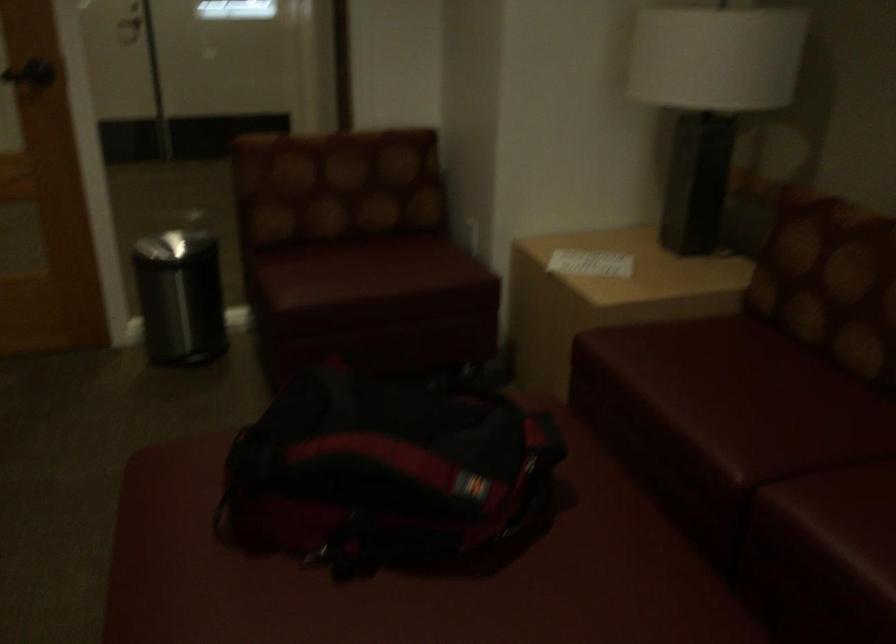
Image resolution: width=896 pixels, height=644 pixels. Describe the element at coordinates (367, 270) in the screenshot. I see `the chair sitting surface` at that location.